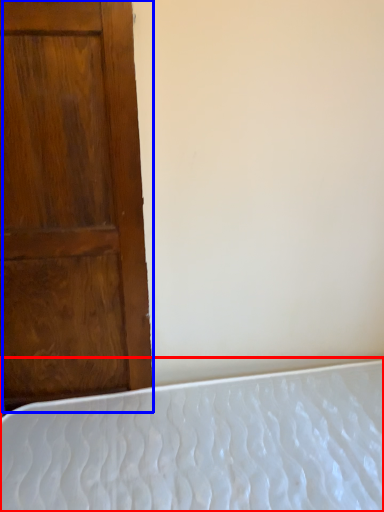
Question: Among these objects, which one is nearest to the camera, bed (highlighted by a red box) or door (highlighted by a blue box)?

Choices:
 (A) bed
 (B) door

Answer: (A)